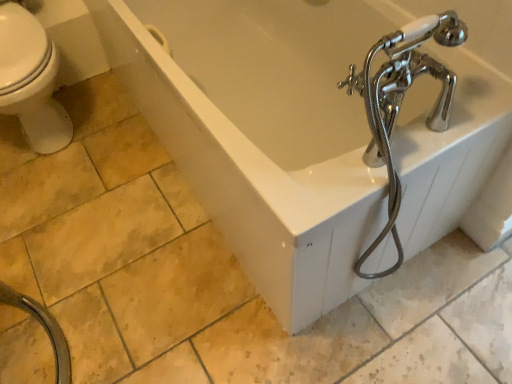
Question: From the image's perspective, is white glossy bathtub at center located above or below black rubber garden hose at lower left?

Choices:
 (A) below
 (B) above

Answer: (B)

Question: Considering the positions of white glossy bathtub at center and black rubber garden hose at lower left in the image, is white glossy bathtub at center wider or thinner than black rubber garden hose at lower left?

Choices:
 (A) thin
 (B) wide

Answer: (B)

Question: Is white glossy bathtub at center inside the boundaries of black rubber garden hose at lower left, or outside?

Choices:
 (A) outside
 (B) inside

Answer: (A)

Question: Relative to white glossy bathtub at center, is black rubber garden hose at lower left in front or behind?

Choices:
 (A) front
 (B) behind

Answer: (A)

Question: Is black rubber garden hose at lower left taller or shorter than white glossy bathtub at center?

Choices:
 (A) short
 (B) tall

Answer: (A)

Question: From a real-world perspective, is black rubber garden hose at lower left physically located above or below white glossy bathtub at center?

Choices:
 (A) above
 (B) below

Answer: (B)

Question: Is black rubber garden hose at lower left bigger or smaller than white glossy bathtub at center?

Choices:
 (A) small
 (B) big

Answer: (A)